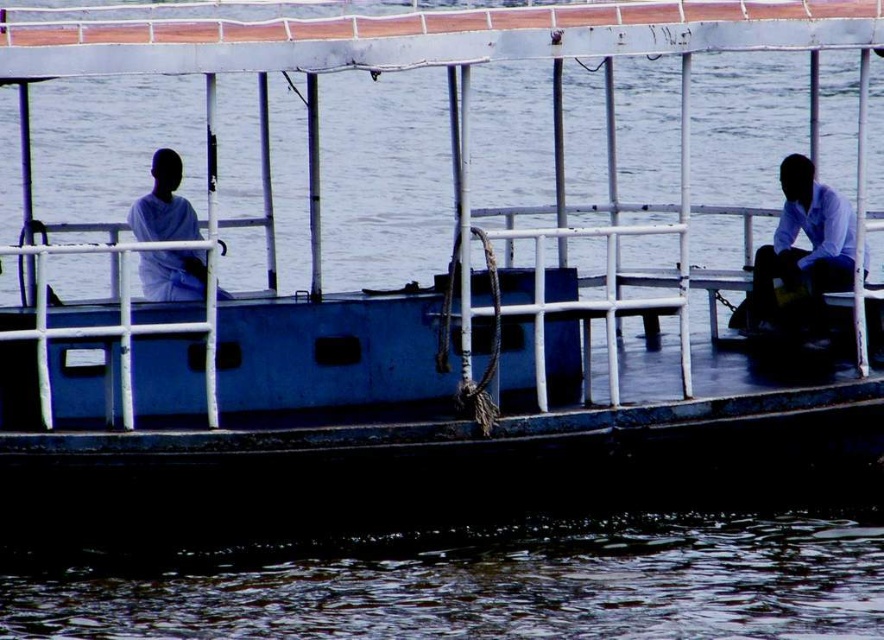
You are standing on the dock and looking at the dark water at lower center and the white matte shirt at left. Which one is higher from the ground?

The white matte shirt at left is taller than the dark water at lower center because the dark water at lower center is not as tall as white matte shirt at left.

You are standing on the dock and looking at the dark water at lower center and the white matte shirt at right. Which object is closer to the bottom of the image?

The dark water at lower center is below the white matte shirt at right, so it is closer to the bottom of the image.